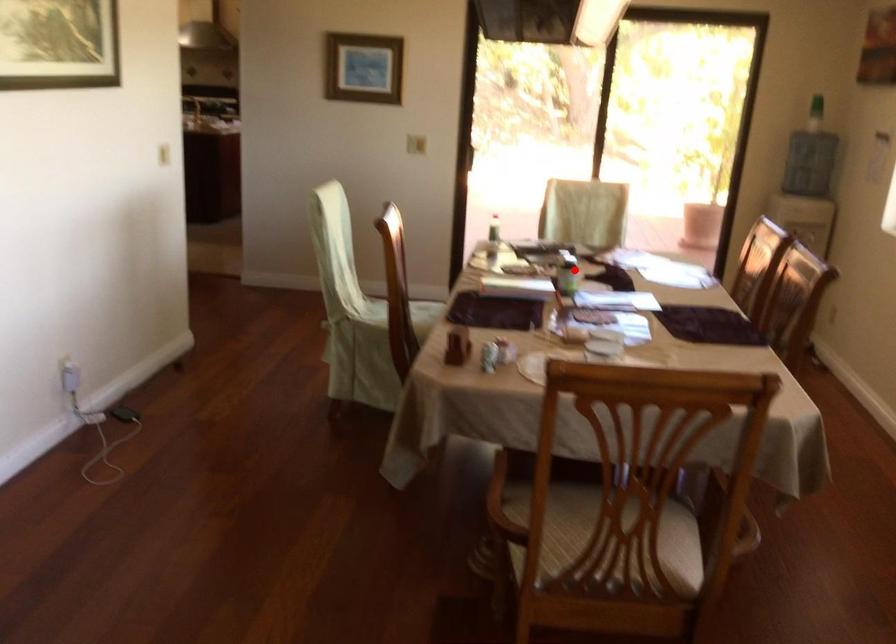
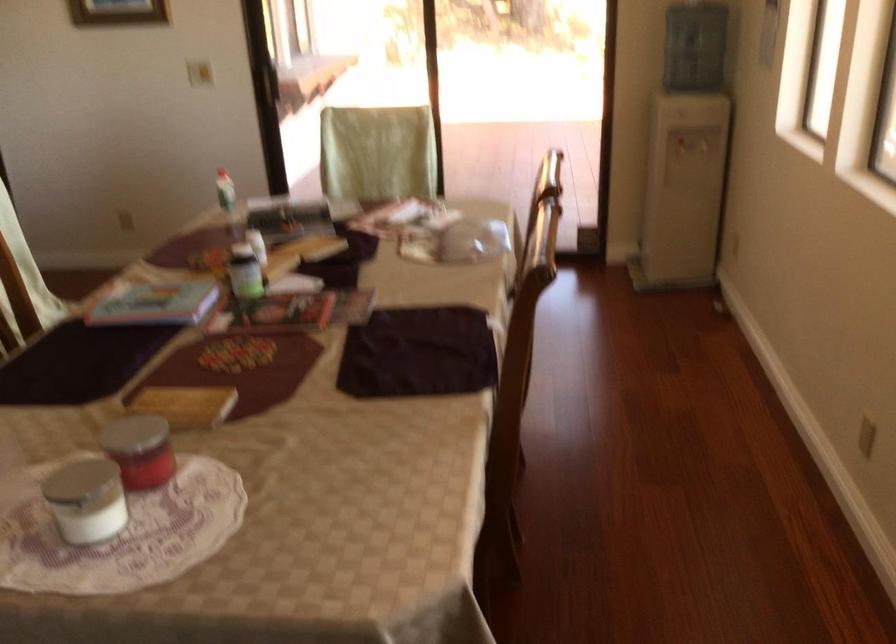
Question: I am providing you with two images of the same scene from different viewpoints. Given a red point in image1, look at the same physical point in image2. Is it:

Choices:
 (A) Closer to the viewpoint
 (B) Farther from the viewpoint

Answer: (A)